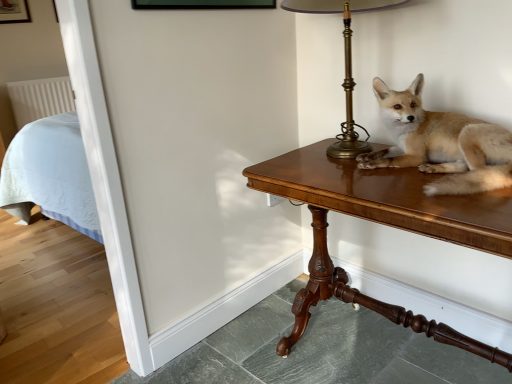
Question: Is brass lampshade at upper right in front of or behind light brown fur at center in the image?

Choices:
 (A) front
 (B) behind

Answer: (B)

Question: Is brass lampshade at upper right taller or shorter than light brown fur at center?

Choices:
 (A) short
 (B) tall

Answer: (B)

Question: Which object is positioned closest to the light brown fur at center?

Choices:
 (A) wooden table at right
 (B) brass lampshade at upper right

Answer: (A)

Question: Based on their relative distances, which object is nearer to the brass lampshade at upper right?

Choices:
 (A) light brown fur at center
 (B) wooden table at right

Answer: (A)